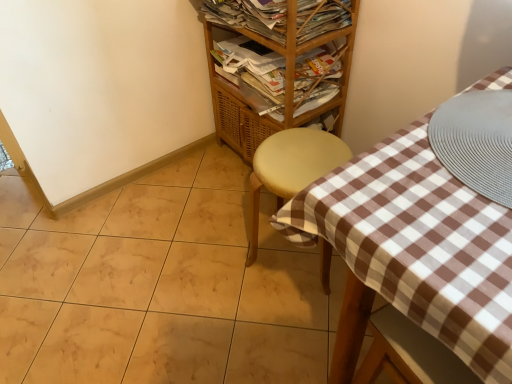
Question: Is wooden magazine at upper center, marked as the 1th magazine in a bottom-to-top arrangement, situated inside wooden magazine rack at upper center, which is the 2th magazine from bottom to top, or outside?

Choices:
 (A) outside
 (B) inside

Answer: (A)

Question: From a real-world perspective, relative to wooden magazine rack at upper center, which is the 2th magazine from bottom to top, is wooden magazine at upper center, marked as the 1th magazine in a bottom-to-top arrangement, vertically above or below?

Choices:
 (A) below
 (B) above

Answer: (A)

Question: Which object is the closest to the wooden magazine rack at upper center, which is the 2th magazine from bottom to top?

Choices:
 (A) wooden/matte shelf at upper center
 (B) matte yellow stool at center
 (C) wooden magazine at upper center, marked as the 2th magazine in a top-to-bottom arrangement

Answer: (A)

Question: Considering the real-world distances, which object is closest to the matte yellow stool at center?

Choices:
 (A) wooden magazine at upper center, marked as the 1th magazine in a bottom-to-top arrangement
 (B) wooden magazine rack at upper center, which is the 1th magazine from top to bottom
 (C) wooden/matte shelf at upper center

Answer: (A)